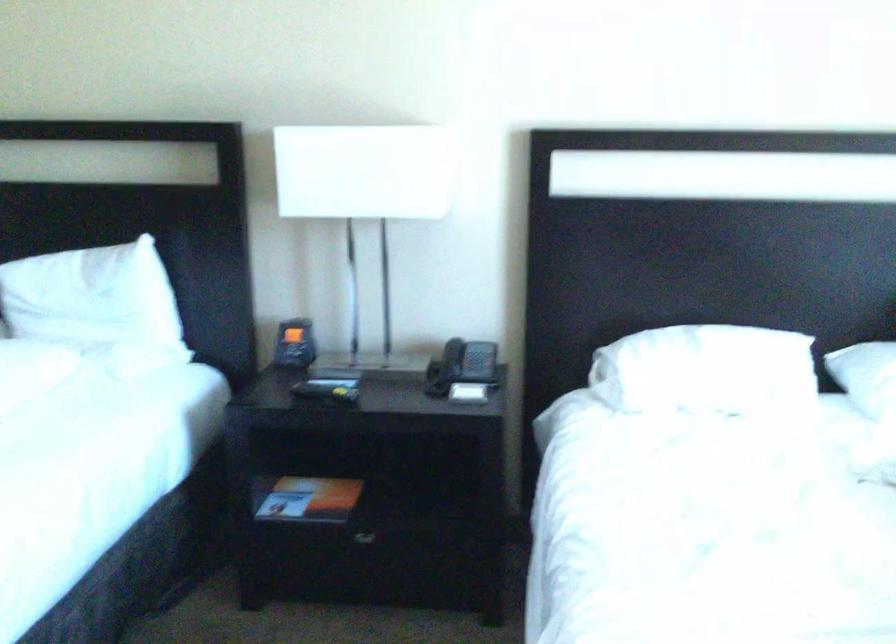
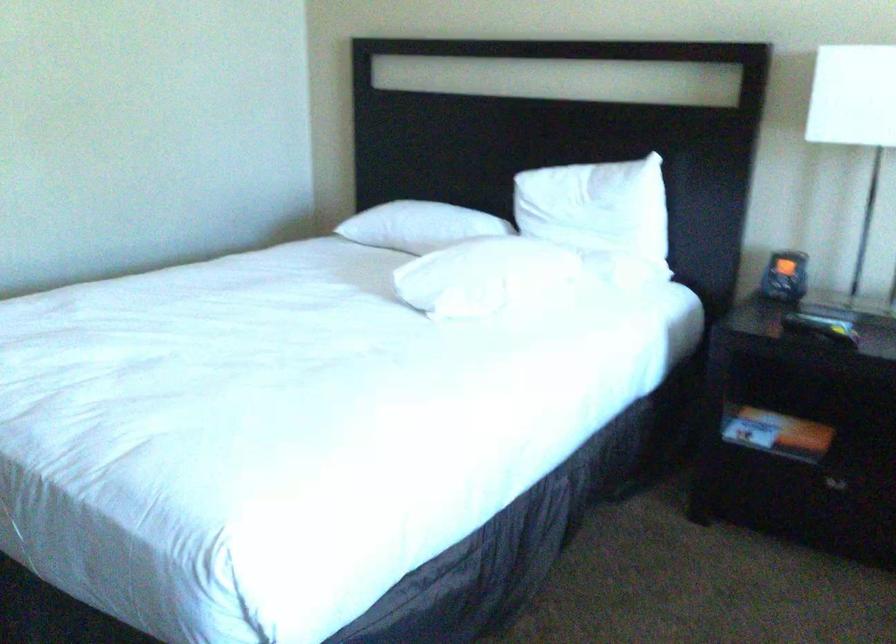
The point at (x=285, y=502) is marked in the first image. Where is the corresponding point in the second image?

(752, 427)